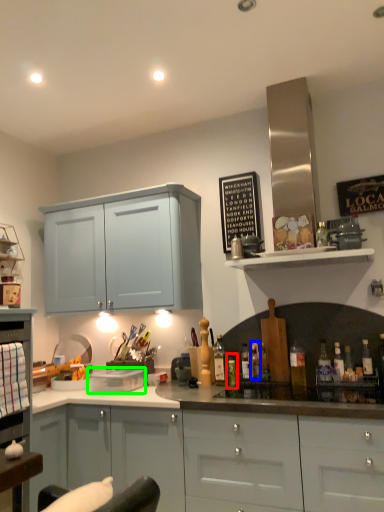
Question: Based on their relative distances, which object is farther from bottle (highlighted by a red box)? Choose from bottle (highlighted by a blue box) and appliance (highlighted by a green box).

Choices:
 (A) bottle
 (B) appliance

Answer: (B)